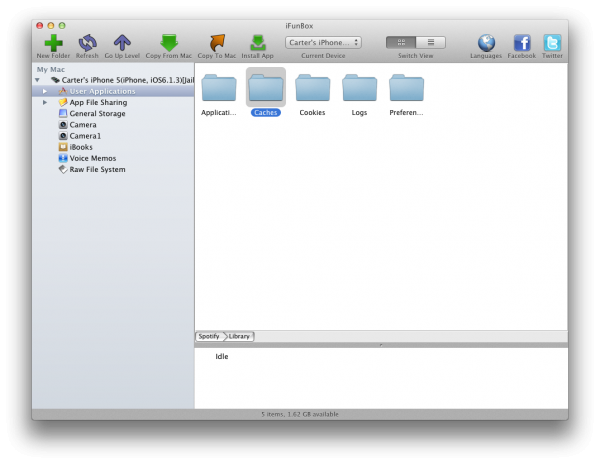
You are a GUI agent. You are given a task and a screenshot of the screen. Output one action in this format:
    pyautogui.click(x=<x>, y=<y>)
    Task: Click on the window
    The width and height of the screenshot is (600, 464).
    Given the screenshot: What is the action you would take?
    pyautogui.click(x=279, y=388), pyautogui.click(x=384, y=190), pyautogui.click(x=147, y=133), pyautogui.click(x=292, y=247)